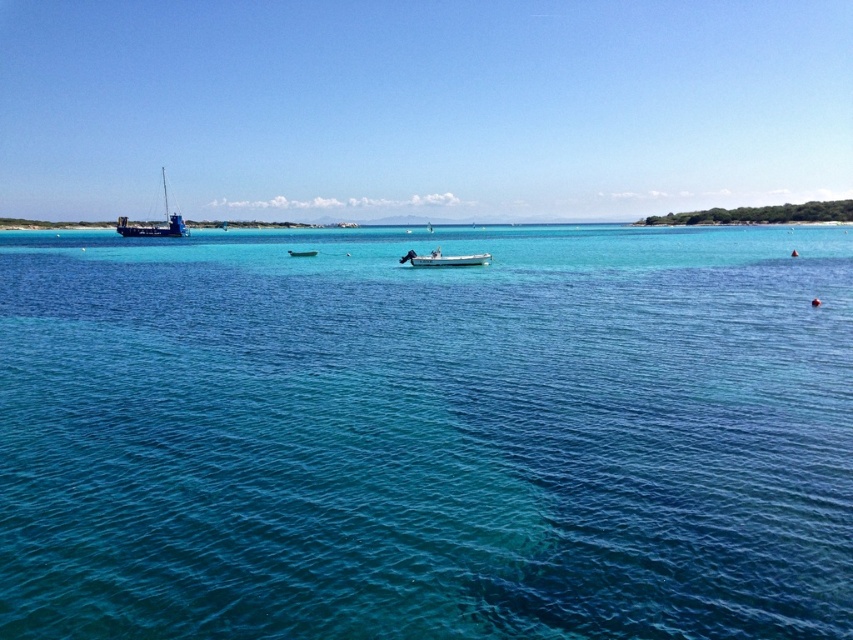
Question: Can you confirm if clear blue water at center is positioned below metallic silver boat at center?

Choices:
 (A) no
 (B) yes

Answer: (A)

Question: Is clear blue water at center to the right of white plastic boat at center from the viewer's perspective?

Choices:
 (A) no
 (B) yes

Answer: (B)

Question: Among these objects, which one is farthest from the camera?

Choices:
 (A) metallic blue boat at left
 (B) clear blue water at center
 (C) metallic silver boat at center
 (D) white plastic boat at center

Answer: (A)

Question: Based on their relative distances, which object is nearer to the metallic blue boat at left?

Choices:
 (A) metallic silver boat at center
 (B) white plastic boat at center
 (C) clear blue water at center

Answer: (C)

Question: Is metallic blue boat at left wider than white plastic boat at center?

Choices:
 (A) no
 (B) yes

Answer: (B)

Question: Which object is the closest to the metallic blue boat at left?

Choices:
 (A) metallic silver boat at center
 (B) white plastic boat at center

Answer: (A)